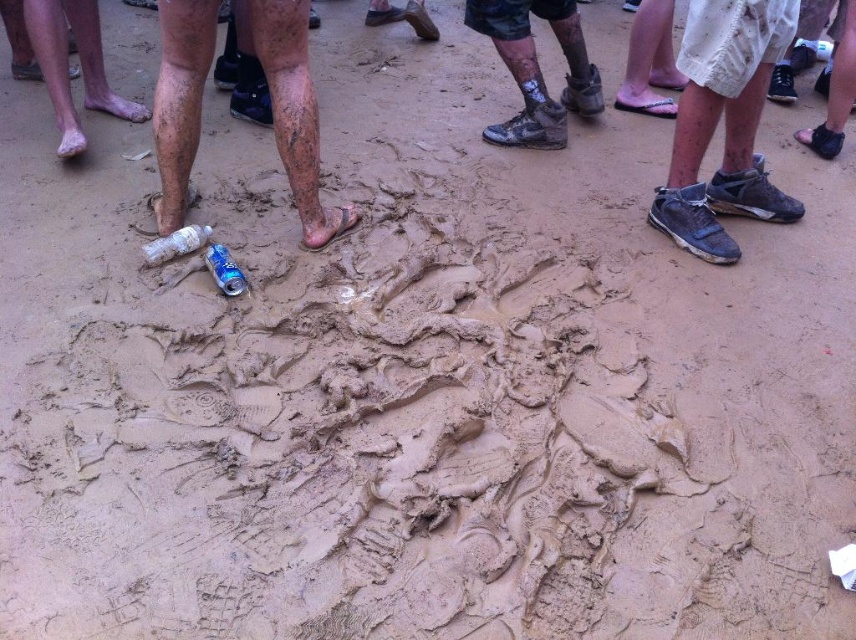
Does muddy skin legs at lower center appear under blue metallic can at center?

Actually, muddy skin legs at lower center is above blue metallic can at center.

Consider the image. Does muddy skin legs at lower center have a larger size compared to blue metallic can at center?

Correct, muddy skin legs at lower center is larger in size than blue metallic can at center.

Who is more distant from viewer, (270,88) or (212,259)?

Point (270,88)

I want to click on muddy skin legs at lower center, so click(295, 113).

Is dirty gray sneakers at lower right above muddy skin legs at lower center?

Yes.

This screenshot has height=640, width=856. What are the coordinates of `dirty gray sneakers at lower right` in the screenshot? It's located at (724, 124).

Is bare skin at lower left behind blue metallic can at center?

Yes, bare skin at lower left is further from the viewer.

Locate an element on the screen. The width and height of the screenshot is (856, 640). bare skin at lower left is located at coordinates (67, 67).

You are a GUI agent. You are given a task and a screenshot of the screen. Output one action in this format:
    pyautogui.click(x=<x>, y=<y>)
    Task: Click on the bare skin at lower left
    The width and height of the screenshot is (856, 640).
    Given the screenshot: What is the action you would take?
    pyautogui.click(x=67, y=67)